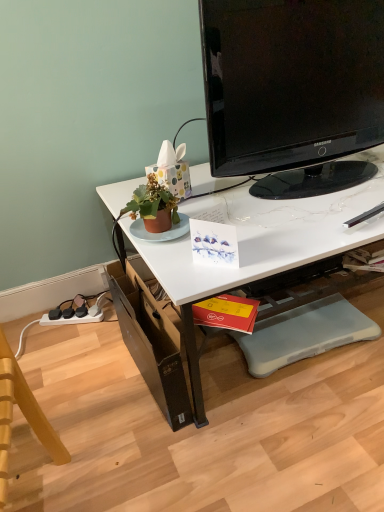
Identify the location of vacant region under black glossy television at upper center (from a real-world perspective). The width and height of the screenshot is (384, 512). (281, 188).